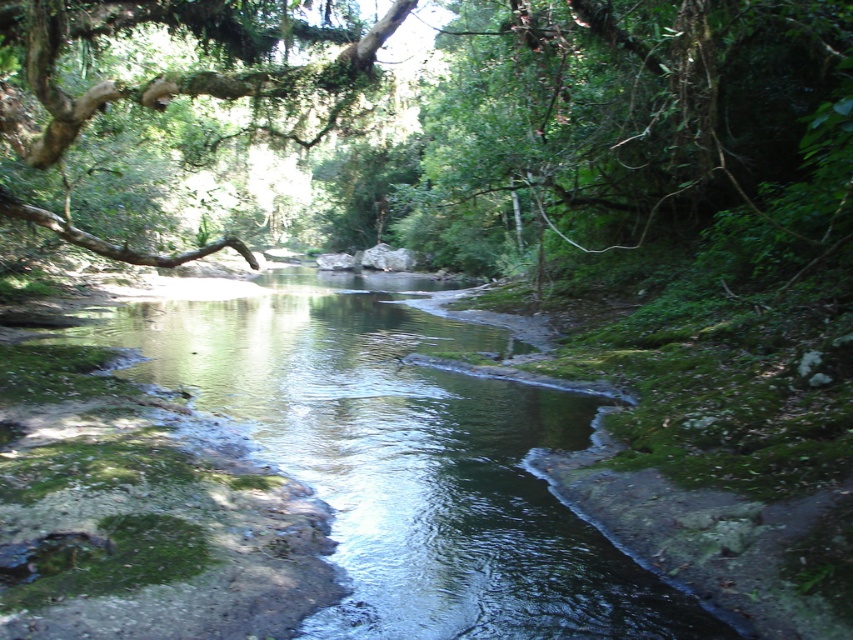
Describe the element at coordinates (405, 460) in the screenshot. I see `green mossy river at center` at that location.

Does green mossy river at center appear over green mossy branch at upper left?

No.

Which is in front, point (598, 618) or point (177, 256)?

Point (598, 618) is more forward.

Find the location of a particular element. green mossy river at center is located at coordinates (405, 460).